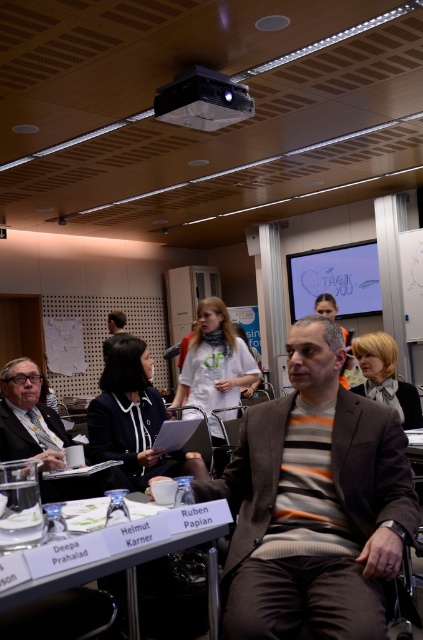
Who is positioned more to the right, striped wool sweater at center or white plastic table at center?

From the viewer's perspective, striped wool sweater at center appears more on the right side.

Which is above, striped wool sweater at center or white plastic table at center?

striped wool sweater at center is above.

Who is more forward, [220,477] or [38,582]?

Result: Point [38,582] is more forward.

The image size is (423, 640). Find the location of `striped wool sweater at center`. striped wool sweater at center is located at coordinates (315, 502).

Is white plastic table at center further to the viewer compared to matte black jacket at center?

No, it is in front of matte black jacket at center.

Which is more to the right, white plastic table at center or matte black jacket at center?

white plastic table at center is more to the right.

Between point (136, 592) and point (109, 339), which one is positioned in front?

Positioned in front is point (136, 592).

At what (x,y) coordinates should I click in order to perform the action: click on white plastic table at center. Please return your answer as a coordinate pair (x, y). The image size is (423, 640). Looking at the image, I should click on (126, 573).

Is point (153, 406) behind point (173, 118)?

No.

Can you confirm if white shirt at center is positioned below black plastic projector at upper center?

Yes, white shirt at center is below black plastic projector at upper center.

Is point (142, 435) less distant than point (214, 125)?

Yes.

Image resolution: width=423 pixels, height=640 pixels. I want to click on white shirt at center, so click(134, 419).